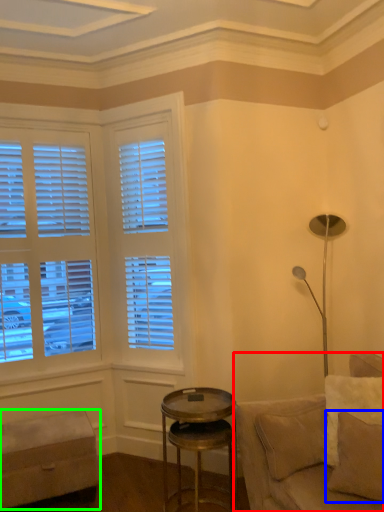
Question: Which object is the farthest from studio couch (highlighted by a red box)? Choose among these: pillow (highlighted by a blue box) or bar stool (highlighted by a green box).

Choices:
 (A) pillow
 (B) bar stool

Answer: (B)